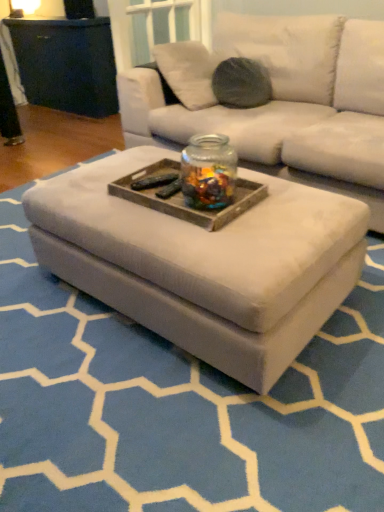
Question: In terms of height, does white fabric ottoman at center look taller or shorter compared to transparent glass jar at center?

Choices:
 (A) tall
 (B) short

Answer: (B)

Question: Considering the positions of white fabric ottoman at center and transparent glass jar at center in the image, is white fabric ottoman at center wider or thinner than transparent glass jar at center?

Choices:
 (A) thin
 (B) wide

Answer: (B)

Question: Estimate the real-world distances between objects in this image. Which object is closer to the white fabric ottoman at center?

Choices:
 (A) wooden tray at center
 (B) transparent glass jar at center

Answer: (A)

Question: Which is farther from the transparent glass jar at center?

Choices:
 (A) white fabric ottoman at center
 (B) wooden tray at center

Answer: (A)